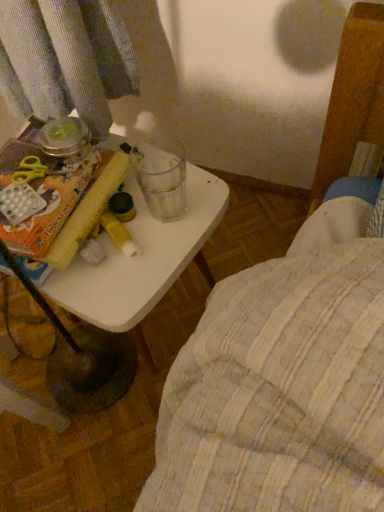
Question: Is white plastic table at center at the left side of yellow paper at left?

Choices:
 (A) no
 (B) yes

Answer: (A)

Question: From the image's perspective, is white plastic table at center located above yellow paper at left?

Choices:
 (A) yes
 (B) no

Answer: (B)

Question: Does white plastic table at center come behind yellow paper at left?

Choices:
 (A) yes
 (B) no

Answer: (A)

Question: Is white plastic table at center wider than yellow paper at left?

Choices:
 (A) yes
 (B) no

Answer: (A)

Question: Does white plastic table at center come in front of yellow paper at left?

Choices:
 (A) yes
 (B) no

Answer: (B)

Question: From the image's perspective, does white plastic table at center appear lower than yellow paper at left?

Choices:
 (A) yes
 (B) no

Answer: (A)

Question: Is yellow paper at left to the right of white plastic table at center from the viewer's perspective?

Choices:
 (A) no
 (B) yes

Answer: (A)

Question: From the image's perspective, is yellow paper at left below white plastic table at center?

Choices:
 (A) yes
 (B) no

Answer: (B)

Question: Can you confirm if yellow paper at left is shorter than white plastic table at center?

Choices:
 (A) no
 (B) yes

Answer: (B)

Question: Is yellow paper at left positioned behind white plastic table at center?

Choices:
 (A) no
 (B) yes

Answer: (A)

Question: Considering the relative sizes of yellow paper at left and white plastic table at center in the image provided, is yellow paper at left thinner than white plastic table at center?

Choices:
 (A) no
 (B) yes

Answer: (B)

Question: Does yellow paper at left appear on the left side of white plastic table at center?

Choices:
 (A) no
 (B) yes

Answer: (B)

Question: Is yellow paper at left bigger or smaller than white plastic table at center?

Choices:
 (A) small
 (B) big

Answer: (A)